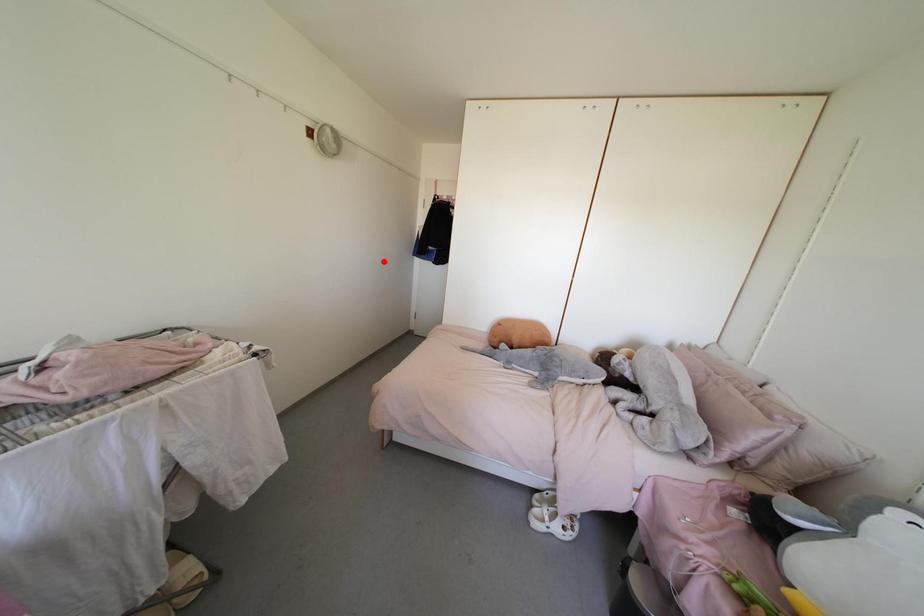
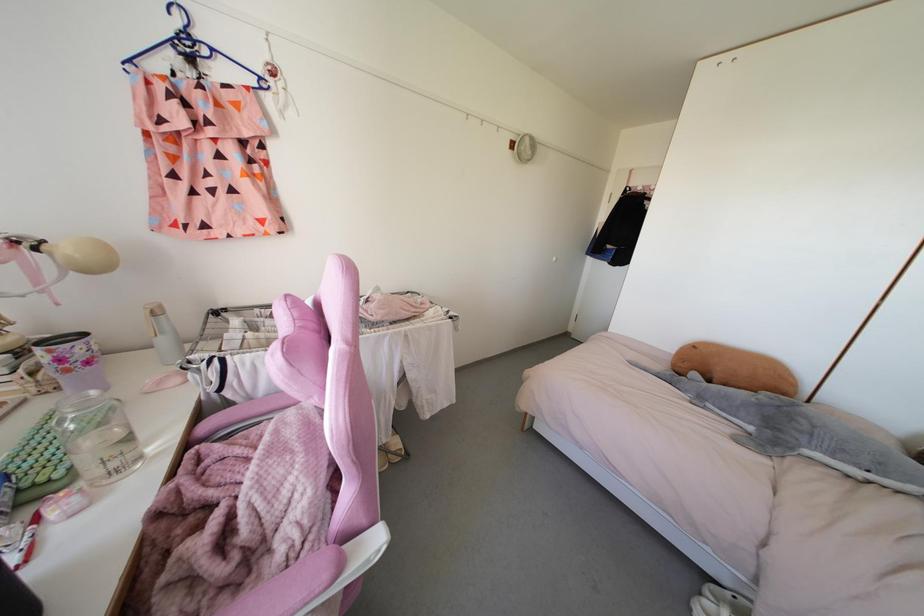
Locate, in the second image, the point that corresponds to the highlighted location in the first image.

(553, 257)